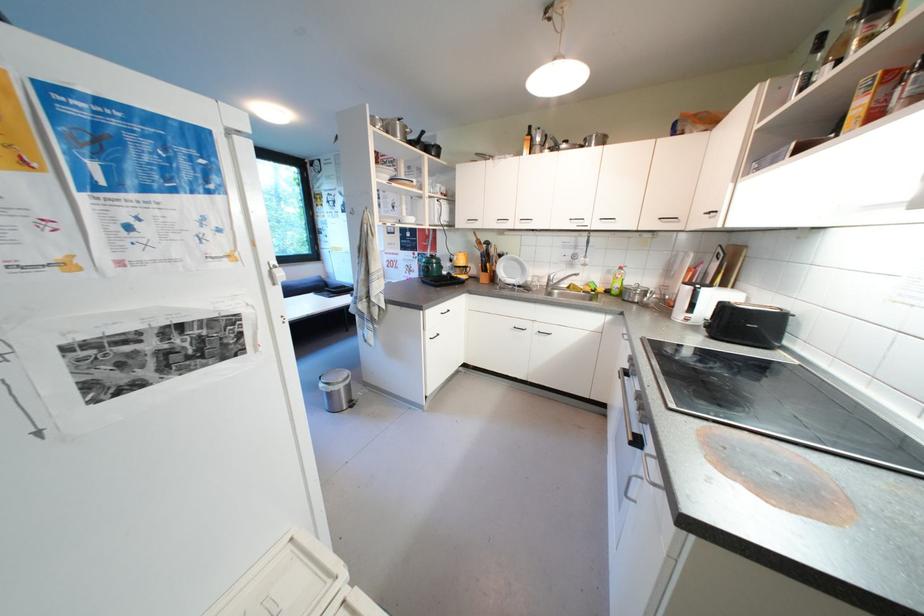
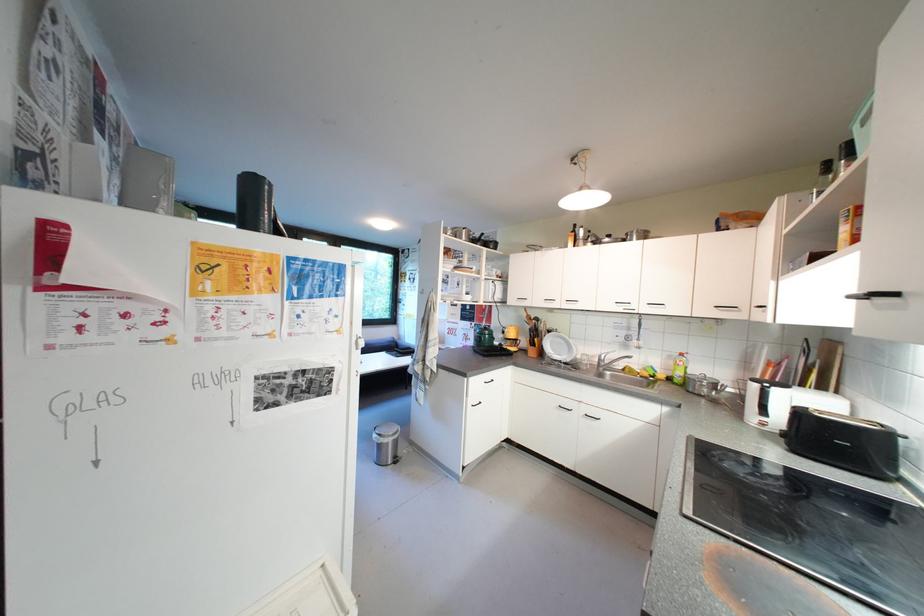
Find the pixel in the second image that matches pixel 616 274 in the first image.

(677, 359)